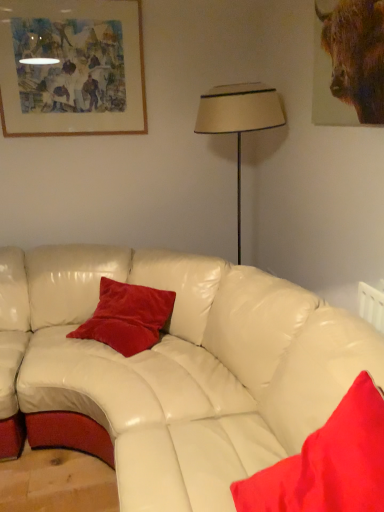
Question: Is wooden framed artwork at upper left taller than velvet red pillow at center, marked as the first pillow in a left-to-right arrangement?

Choices:
 (A) yes
 (B) no

Answer: (A)

Question: From a real-world perspective, does wooden framed artwork at upper left stand above velvet red pillow at center, marked as the first pillow in a left-to-right arrangement?

Choices:
 (A) no
 (B) yes

Answer: (B)

Question: Is wooden framed artwork at upper left oriented towards velvet red pillow at center, which ranks as the first pillow in back-to-front order?

Choices:
 (A) yes
 (B) no

Answer: (B)

Question: Is wooden framed artwork at upper left looking in the opposite direction of velvet red pillow at center, marked as the first pillow in a left-to-right arrangement?

Choices:
 (A) no
 (B) yes

Answer: (A)

Question: From a real-world perspective, is wooden framed artwork at upper left below velvet red pillow at center, the 2th pillow when ordered from front to back?

Choices:
 (A) no
 (B) yes

Answer: (A)

Question: Based on their positions, is velvet red pillow at center, the 2th pillow in the right-to-left sequence, located to the left or right of brown furry bull at upper right?

Choices:
 (A) right
 (B) left

Answer: (B)

Question: Considering the positions of velvet red pillow at center, marked as the first pillow in a left-to-right arrangement, and brown furry bull at upper right in the image, is velvet red pillow at center, marked as the first pillow in a left-to-right arrangement, bigger or smaller than brown furry bull at upper right?

Choices:
 (A) big
 (B) small

Answer: (A)

Question: From their relative heights in the image, would you say velvet red pillow at center, the 2th pillow when ordered from front to back, is taller or shorter than brown furry bull at upper right?

Choices:
 (A) short
 (B) tall

Answer: (A)

Question: Is point (94, 329) closer or farther from the camera than point (326, 37)?

Choices:
 (A) farther
 (B) closer

Answer: (A)

Question: From the image's perspective, is beige fabric lampshade at center above or below velvet red pillow at lower right, the 1th pillow in the right-to-left sequence?

Choices:
 (A) above
 (B) below

Answer: (A)

Question: Is beige fabric lampshade at center to the left or to the right of velvet red pillow at lower right, arranged as the 1th pillow when viewed from the front, in the image?

Choices:
 (A) right
 (B) left

Answer: (B)

Question: Looking at the image, does beige fabric lampshade at center seem bigger or smaller compared to velvet red pillow at lower right, the 2th pillow when ordered from back to front?

Choices:
 (A) small
 (B) big

Answer: (B)

Question: Considering the positions of beige fabric lampshade at center and velvet red pillow at lower right, arranged as the 1th pillow when viewed from the front, in the image, is beige fabric lampshade at center taller or shorter than velvet red pillow at lower right, arranged as the 1th pillow when viewed from the front,?

Choices:
 (A) short
 (B) tall

Answer: (B)

Question: From a real-world perspective, relative to velvet red pillow at lower right, the 1th pillow in the right-to-left sequence, is velvet red pillow at center, which ranks as the first pillow in back-to-front order, vertically above or below?

Choices:
 (A) above
 (B) below

Answer: (B)

Question: In the image, is velvet red pillow at center, the 2th pillow when ordered from front to back, positioned in front of or behind velvet red pillow at lower right, the 2th pillow when ordered from back to front?

Choices:
 (A) front
 (B) behind

Answer: (B)